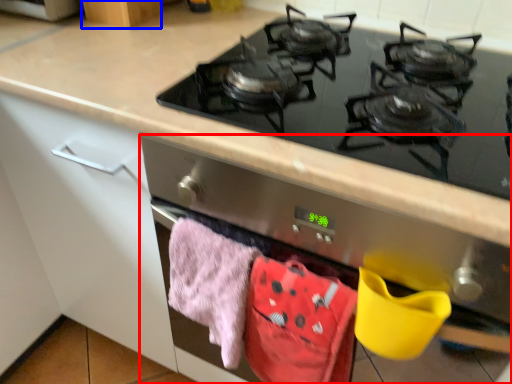
Question: Among these objects, which one is nearest to the camera, oven (highlighted by a red box) or cabinetry (highlighted by a blue box)?

Choices:
 (A) oven
 (B) cabinetry

Answer: (A)